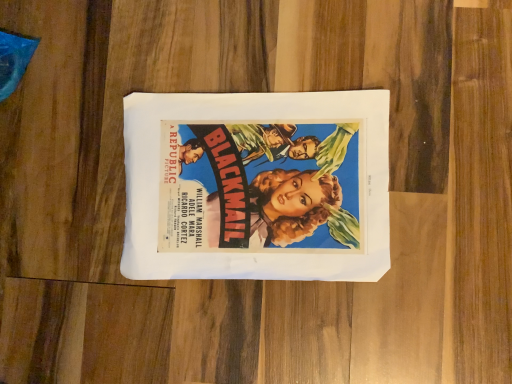
Image resolution: width=512 pixels, height=384 pixels. What are the coordinates of `free space above matte paper poster at center (from a real-world perspective)` in the screenshot? It's located at (253, 181).